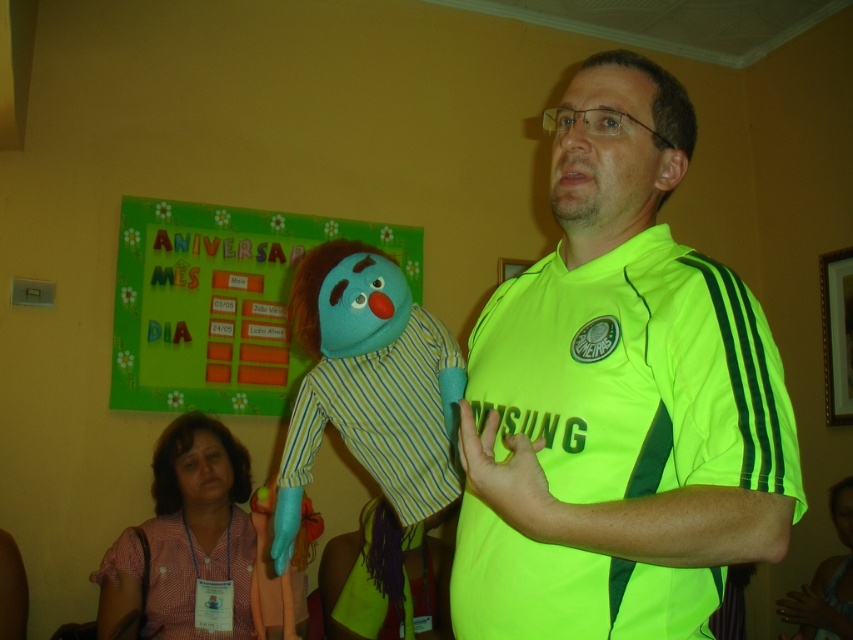
You are organizing a birthday party and need to arrange decorations. You have a green paperboard at upper center and a pink cotton shirt at lower left. Which decoration is taller?

The green paperboard at upper center is taller than the pink cotton shirt at lower left according to the description.

You are an event planner organizing the birthday celebration shown in the image. You need to place a decorative banner directly above the neon green jersey at center. What coordinates should you use to ensure the banner is centered above it?

The banner should be placed at coordinates approximately 0.622 on the x and 0.726 on the y, but slightly higher on the y to be above the neon green jersey at center.

You are an event organizer planning the layout for an upcoming presentation. You have the neon green jersey at center and the blue fabric puppet at center. Based on their positions, which object should be placed higher on the stage to maintain visual hierarchy?

The neon green jersey at center should be placed higher on the stage since it is positioned above the blue fabric puppet at center in the original image, indicating its importance in the visual hierarchy.